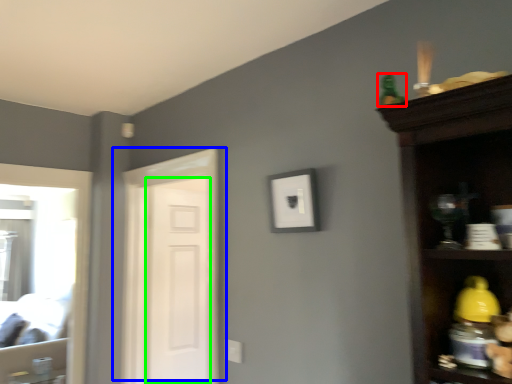
Question: Estimate the real-world distances between objects in this image. Which object is farther from toy (highlighted by a red box), door (highlighted by a blue box) or screen door (highlighted by a green box)?

Choices:
 (A) door
 (B) screen door

Answer: (B)